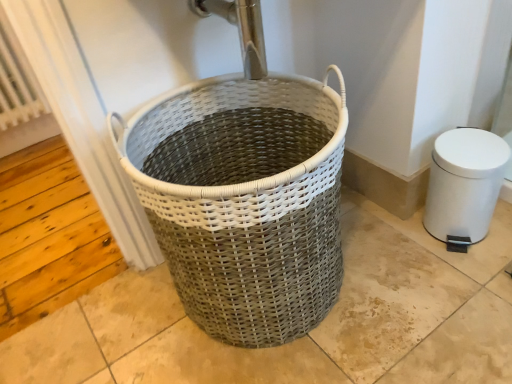
The height and width of the screenshot is (384, 512). Identify the location of vacant space to the right of white woven basket at center. (412, 282).